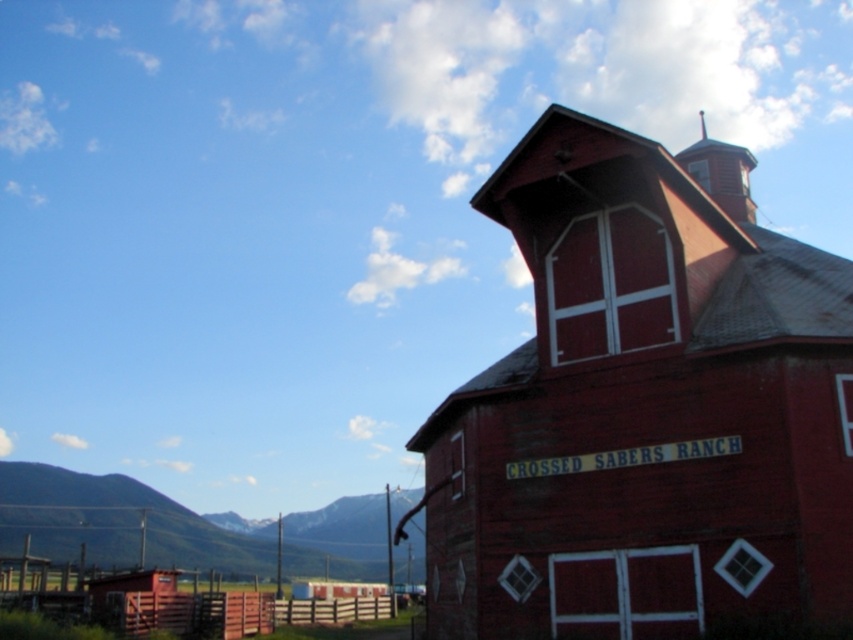
Measure the distance between rustic wood barn tower at upper right and green grassy hill at lower left.

They are 146.32 feet apart.

Who is more distant from viewer, [770,420] or [146,561]?

The point [146,561] is more distant.

Measure the distance between point (457, 550) and camera.

The distance of point (457, 550) from camera is 18.11 meters.

Identify the location of rustic wood barn tower at upper right. (642, 412).

From the picture: Does green grassy hill at lower left have a smaller size compared to metallic spire at upper center?

Indeed, green grassy hill at lower left has a smaller size compared to metallic spire at upper center.

Can you confirm if green grassy hill at lower left is shorter than metallic spire at upper center?

Yes.

You are a GUI agent. You are given a task and a screenshot of the screen. Output one action in this format:
    pyautogui.click(x=<x>, y=<y>)
    Task: Click on the green grassy hill at lower left
    
    Given the screenshot: What is the action you would take?
    coord(117,522)

At what (x,y) coordinates should I click in order to perform the action: click on green grassy hill at lower left. Please return your answer as a coordinate pair (x, y). The height and width of the screenshot is (640, 853). Looking at the image, I should click on (117, 522).

Does point (757, 352) come behind point (682, 166)?

No, it is not.

Which is above, rustic wood barn tower at upper right or metallic spire at upper center?

metallic spire at upper center is above.

Who is more distant from viewer, (596, 289) or (721, 179)?

The point (721, 179) is more distant.

Where is `rustic wood barn tower at upper right`? rustic wood barn tower at upper right is located at coordinates (642, 412).